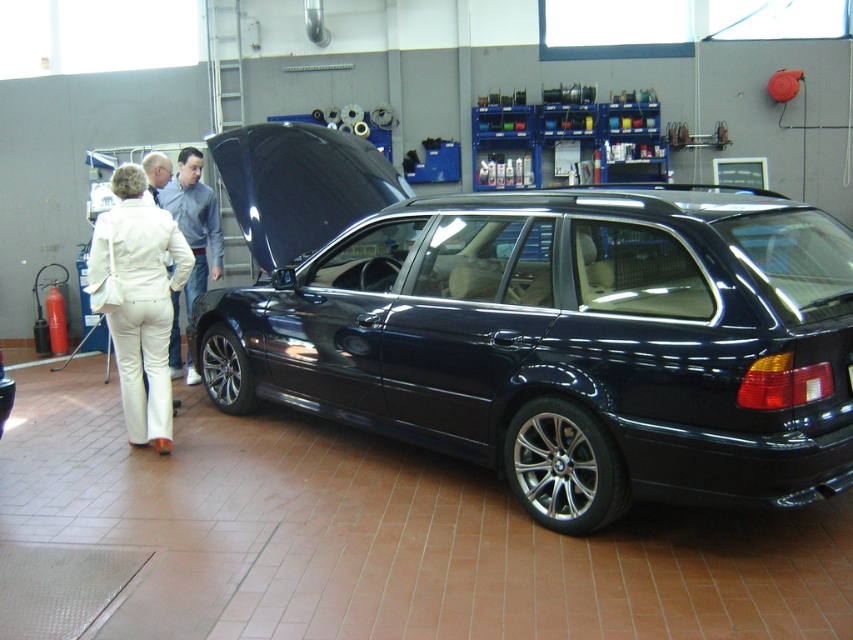
Between white fabric pants at left and blue fabric shirt at center, which one is positioned lower?

white fabric pants at left

Between point (146, 300) and point (195, 291), which one is positioned behind?

Positioned behind is point (195, 291).

At what (x,y) coordinates should I click in order to perform the action: click on white fabric pants at left. Please return your answer as a coordinate pair (x, y). Looking at the image, I should click on (140, 301).

Which is more to the right, glossy black car at center or blue fabric shirt at center?

glossy black car at center

Between point (503, 419) and point (194, 193), which one is positioned in front?

Point (503, 419) is in front.

What are the coordinates of `glossy black car at center` in the screenshot? It's located at (543, 326).

Between point (403, 230) and point (103, 230), which one is positioned behind?

The point (103, 230) is behind.

From the picture: Does glossy black car at center appear over white fabric pants at left?

Yes.

The height and width of the screenshot is (640, 853). I want to click on glossy black car at center, so click(x=543, y=326).

At what (x,y) coordinates should I click in order to perform the action: click on glossy black car at center. Please return your answer as a coordinate pair (x, y). Looking at the image, I should click on coord(543,326).